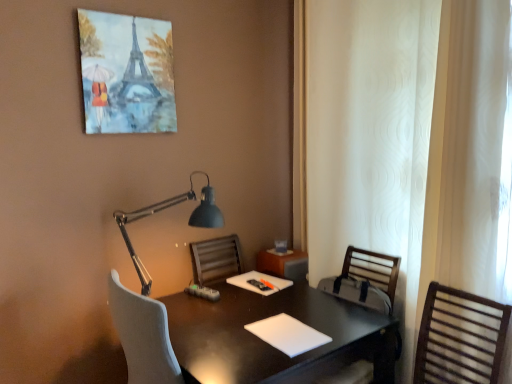
This screenshot has width=512, height=384. In order to click on free spot to the left of white matte notepad at center, which is the second notepad in top-to-bottom order in this screenshot , I will do `click(222, 334)`.